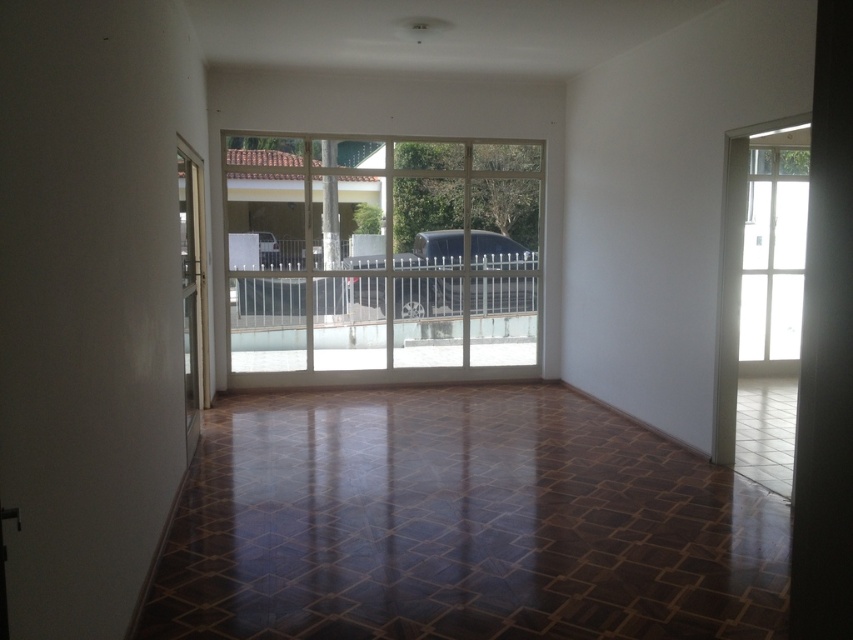
You are moving a wide sofa into the living room and need to pass through the transparent glass door at right and the white metal rail at center. Based on their widths, which one might pose a challenge for the sofa to pass through?

The transparent glass door at right has a lesser width compared to the white metal rail at center, so the transparent glass door at right might pose a challenge for the sofa to pass through since it is narrower.

You are standing inside the living room and want to go outside through the transparent glass door at right. Is the clear glass terrace at center blocking your path?

The clear glass terrace at center is positioned over the transparent glass door at right, so it is blocking the path to the transparent glass door at right. You will need to go around it to exit through the transparent glass door at right.

You are standing in the living room and want to exit through the transparent glass door at right. Is the white metal rail at center blocking your path to the door?

The white metal rail at center is behind the transparent glass door at right, so it is not blocking your path to the door. You can exit through the transparent glass door at right without any obstruction from the white metal rail at center.